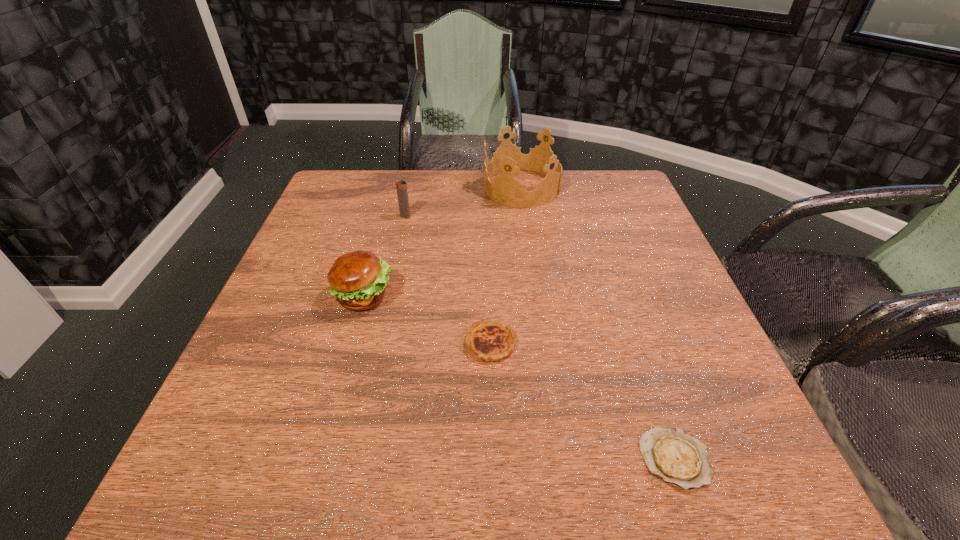
The height and width of the screenshot is (540, 960). Identify the location of tiara. (505, 189).

Image resolution: width=960 pixels, height=540 pixels. I want to click on the tallest object, so click(505, 189).

Find the location of `igniter`. igniter is located at coordinates (401, 186).

Locate an element on the screen. The height and width of the screenshot is (540, 960). the third nearest object is located at coordinates (358, 279).

The height and width of the screenshot is (540, 960). Find the location of `the farther quiche`. the farther quiche is located at coordinates (491, 341).

Locate an element on the screen. This screenshot has height=540, width=960. the left quiche is located at coordinates (491, 341).

Where is `the rightmost object`? the rightmost object is located at coordinates (673, 455).

Find the location of `the shorter quiche`. the shorter quiche is located at coordinates (673, 455).

Where is `vacant point located 0.170m on the front-facing side of the tallest object`? The width and height of the screenshot is (960, 540). vacant point located 0.170m on the front-facing side of the tallest object is located at coordinates (425, 188).

The width and height of the screenshot is (960, 540). I want to click on free space located 0.280m on the front-facing side of the tallest object, so click(x=387, y=188).